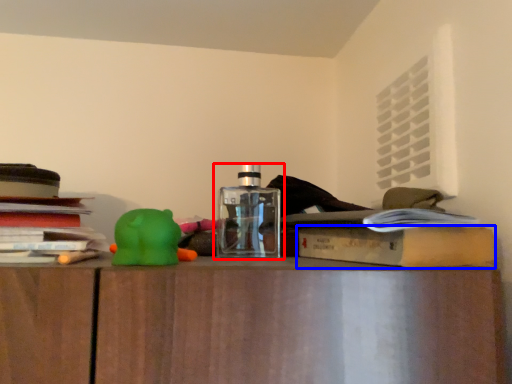
Question: Which point is further to the camera, bottle (highlighted by a red box) or paperback book (highlighted by a blue box)?

Choices:
 (A) bottle
 (B) paperback book

Answer: (A)